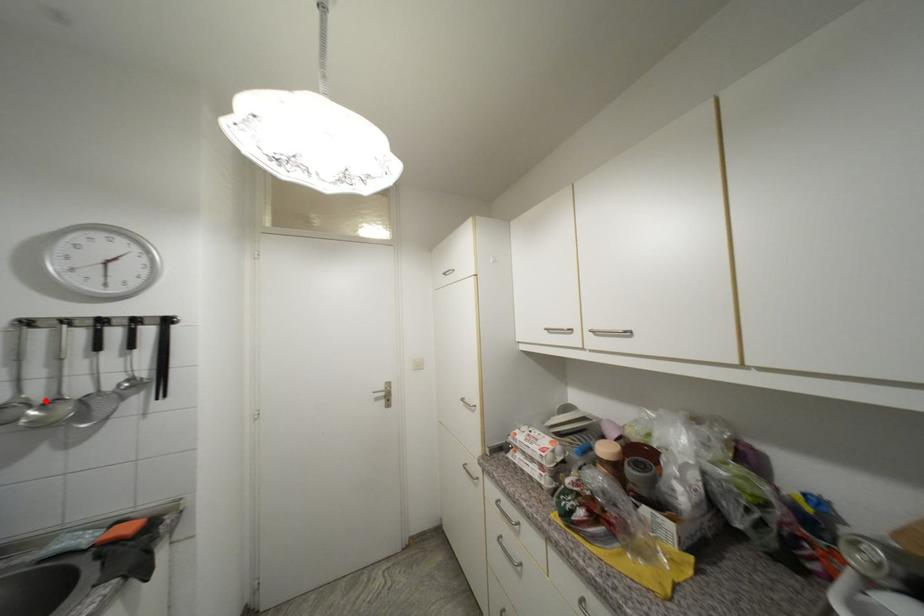
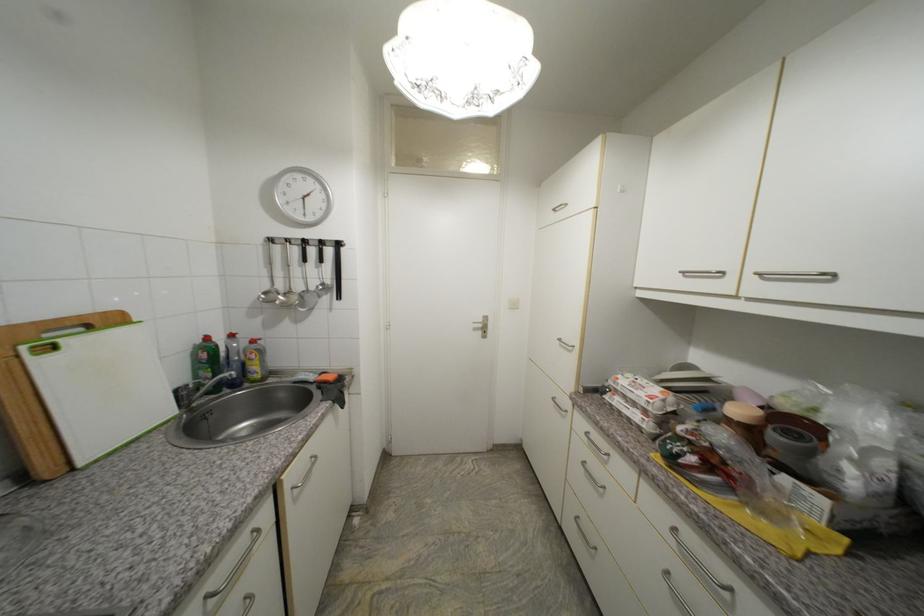
Where in the second image is the point corresponding to the highlighted location from the first image?

(287, 292)